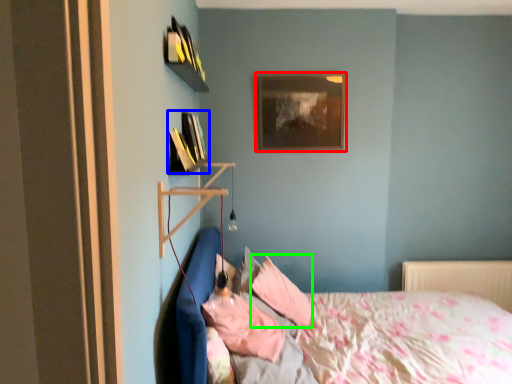
Question: Estimate the real-world distances between objects in this image. Which object is closer to picture frame (highlighted by a red box), book (highlighted by a blue box) or pillow (highlighted by a green box)?

Choices:
 (A) book
 (B) pillow

Answer: (A)